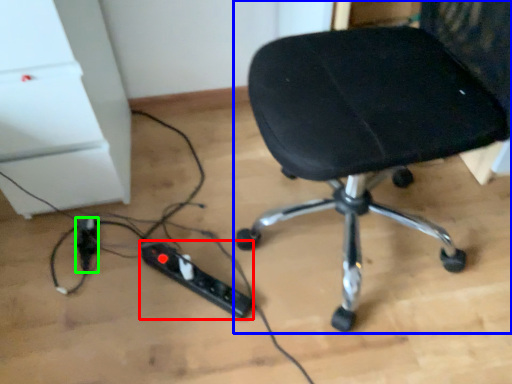
Question: Based on their relative distances, which object is nearer to extension cord (highlighted by a red box)? Choose from chair (highlighted by a blue box) and extension cord (highlighted by a green box).

Choices:
 (A) chair
 (B) extension cord

Answer: (B)